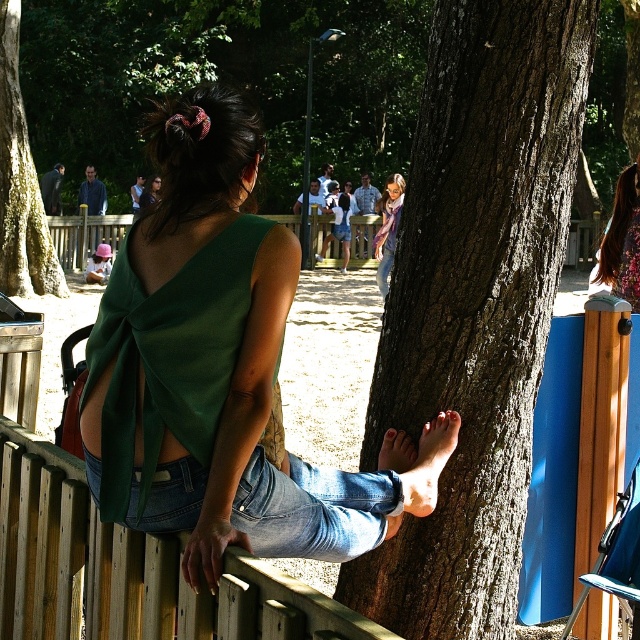
You are a photographer trying to capture the woman in the scene. You notice the jeans at lower center and the smooth brown tree trunk at left. Which object is smaller in size?

The jeans at lower center has a smaller size compared to the smooth brown tree trunk at left.

You are standing in the park and want to touch the smooth brown bark at center. Based on its position, where should you look to find it?

The smooth brown bark at center is located at point 0.475 on the horizontal axis and 0.744 on the vertical axis, so you should look towards the center area slightly to the right and lower down from the top of the image.